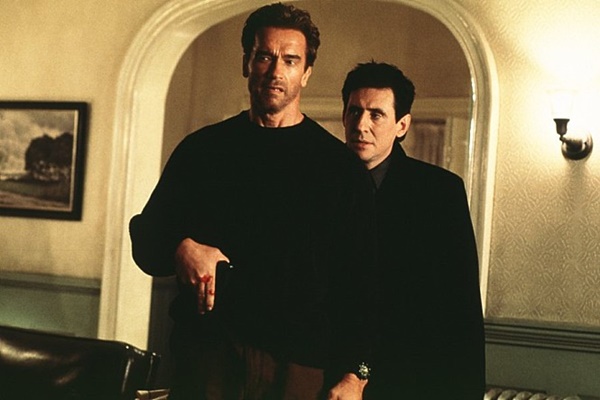
Locate an element on the screen. light is located at coordinates (563, 104).